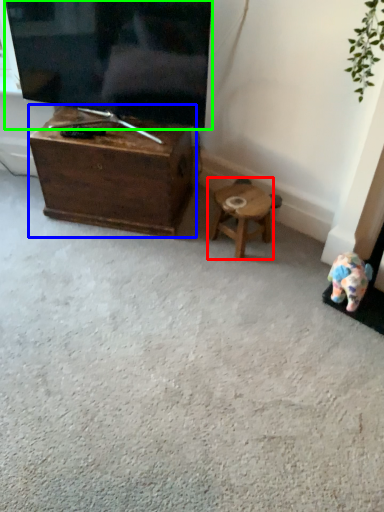
Question: Which is nearer to the stool (highlighted by a red box)? table (highlighted by a blue box) or television (highlighted by a green box).

Choices:
 (A) table
 (B) television

Answer: (A)